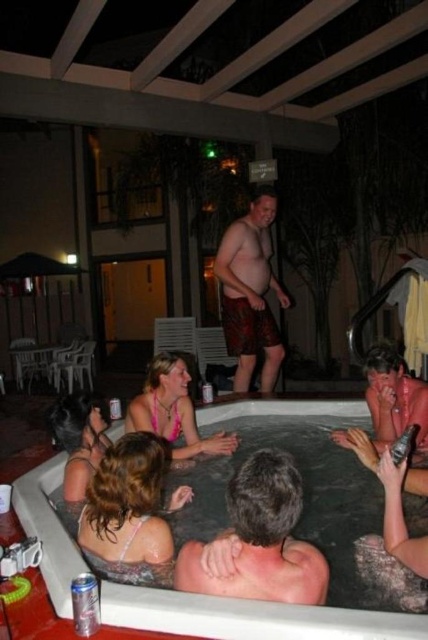
Question: Is printed fabric shorts at center below metallic silver can at lower right?

Choices:
 (A) yes
 (B) no

Answer: (B)

Question: Can you confirm if dark brown hair at back is wider than silver metallic can at lower left?

Choices:
 (A) no
 (B) yes

Answer: (B)

Question: Which is nearer to the dark brown hair at back?

Choices:
 (A) metallic silver can at lower right
 (B) silver metallic can at lower left
 (C) white plastic hot tub at lower center
 (D) pink fabric bikini at lower left

Answer: (C)

Question: Which is nearer to the dark brown hair at back?

Choices:
 (A) white plastic hot tub at lower center
 (B) silver metallic can at lower left

Answer: (A)

Question: Considering the real-world distances, which object is closest to the pink fabric bikini at lower left?

Choices:
 (A) metallic silver can at lower right
 (B) dark brown hair at back
 (C) white plastic hot tub at lower center

Answer: (C)

Question: From the image, what is the correct spatial relationship of dark brown hair at back in relation to metallic silver can at lower right?

Choices:
 (A) right
 (B) left

Answer: (B)